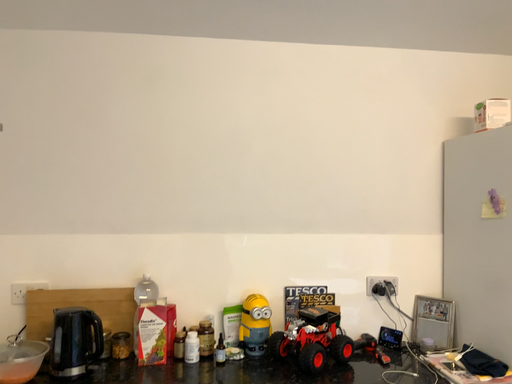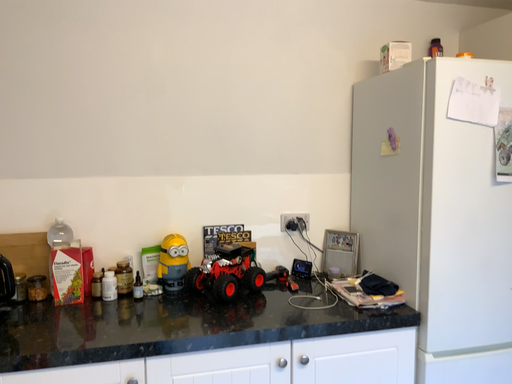
Question: Which way did the camera rotate in the video?

Choices:
 (A) rotated left
 (B) rotated right

Answer: (B)